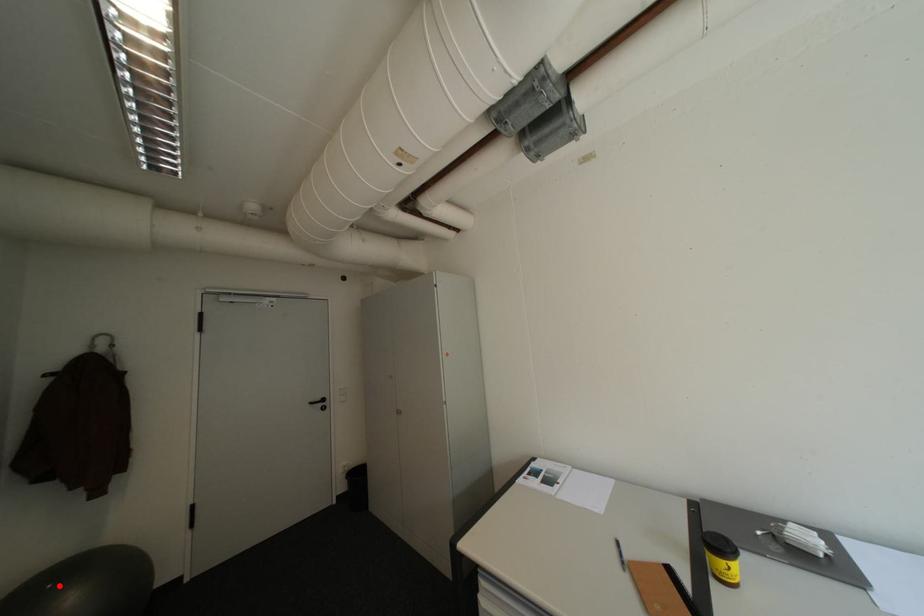
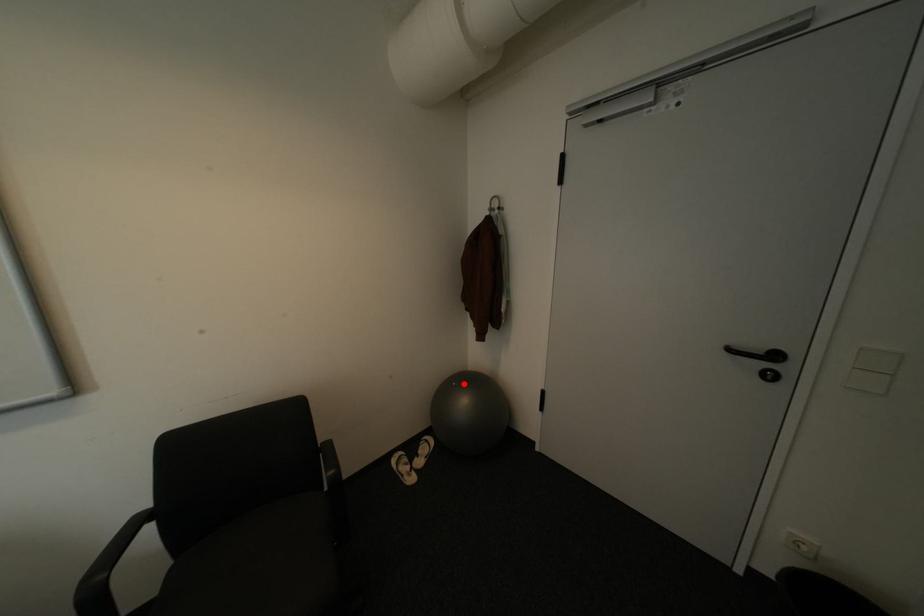
I am providing you with two images of the same scene from different viewpoints. A red point is marked on the first image and another point is marked on the second image. Is the red point in image1 aligned with the point shown in image2?

Yes